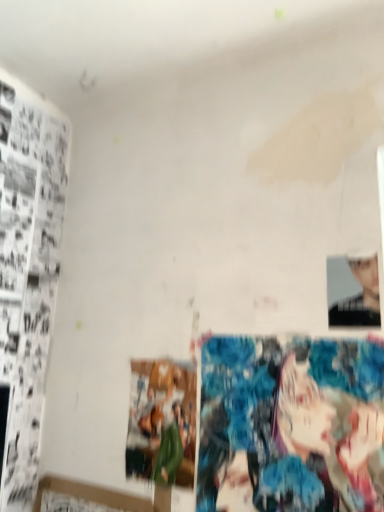
Question: In terms of width, does smooth black portrait at upper right look wider or thinner when compared to colorful fabric art at lower right?

Choices:
 (A) thin
 (B) wide

Answer: (A)

Question: In the image, is smooth black portrait at upper right on the left side or the right side of colorful fabric art at lower right?

Choices:
 (A) left
 (B) right

Answer: (B)

Question: Which is farther from the matte paper print at center?

Choices:
 (A) smooth black portrait at upper right
 (B) colorful fabric art at lower right

Answer: (A)

Question: Which object is positioned farthest from the colorful fabric art at lower right?

Choices:
 (A) smooth black portrait at upper right
 (B) matte paper print at center

Answer: (A)